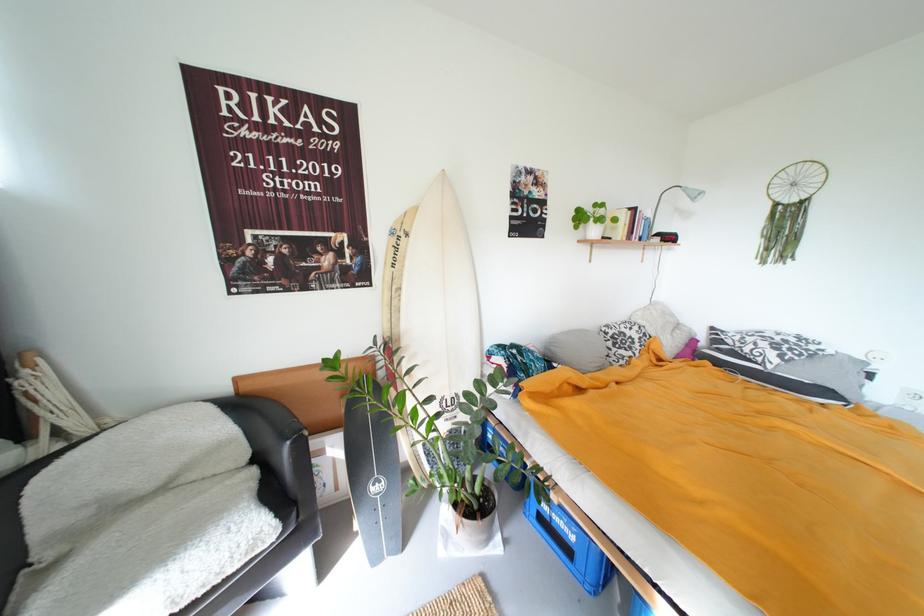
Find where to lift the potted plant. Please return your answer as a coordinate pair (x, y).

(471, 469)